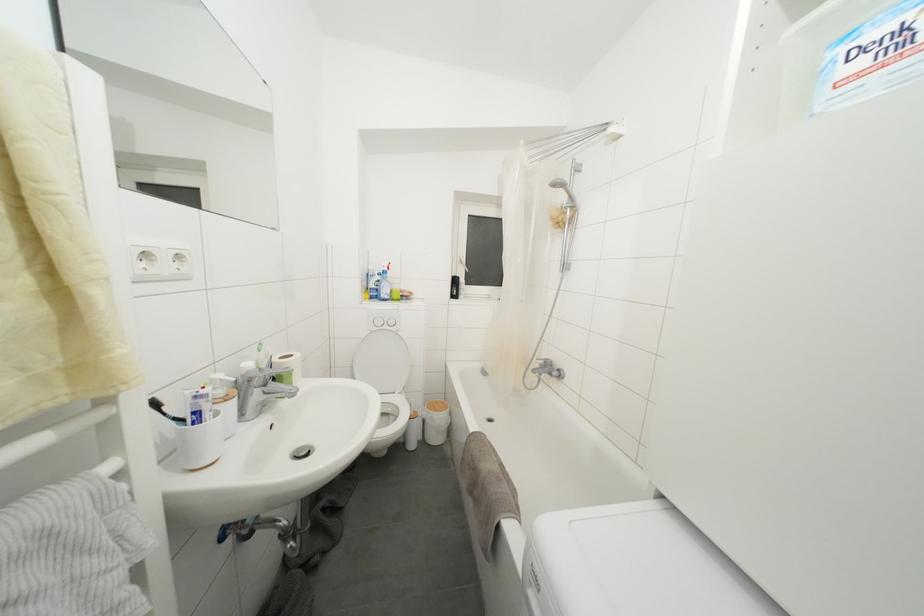
Where is `green cleaning bottle`? The height and width of the screenshot is (616, 924). green cleaning bottle is located at coordinates (383, 286).